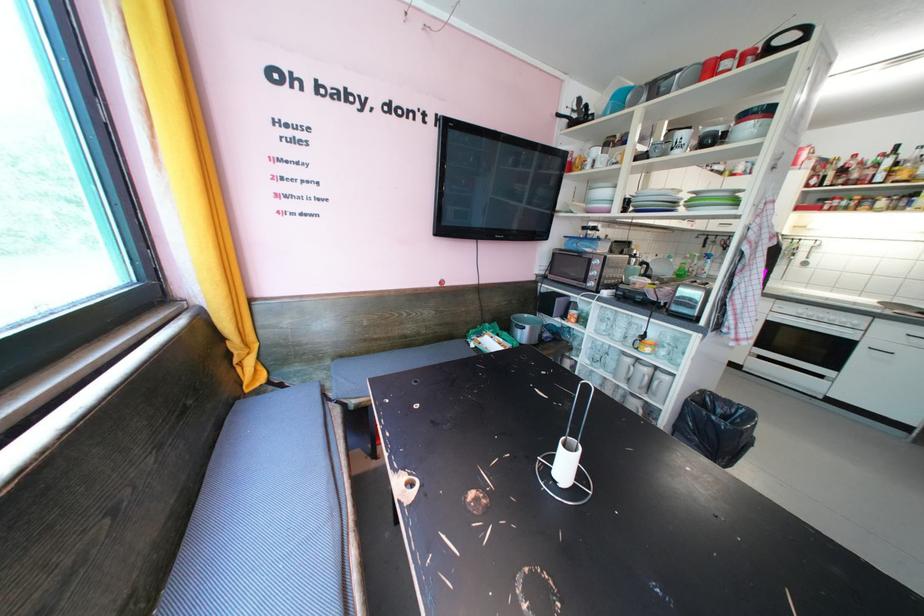
Image resolution: width=924 pixels, height=616 pixels. What do you see at coordinates (565, 462) in the screenshot? I see `a paper towel holder` at bounding box center [565, 462].